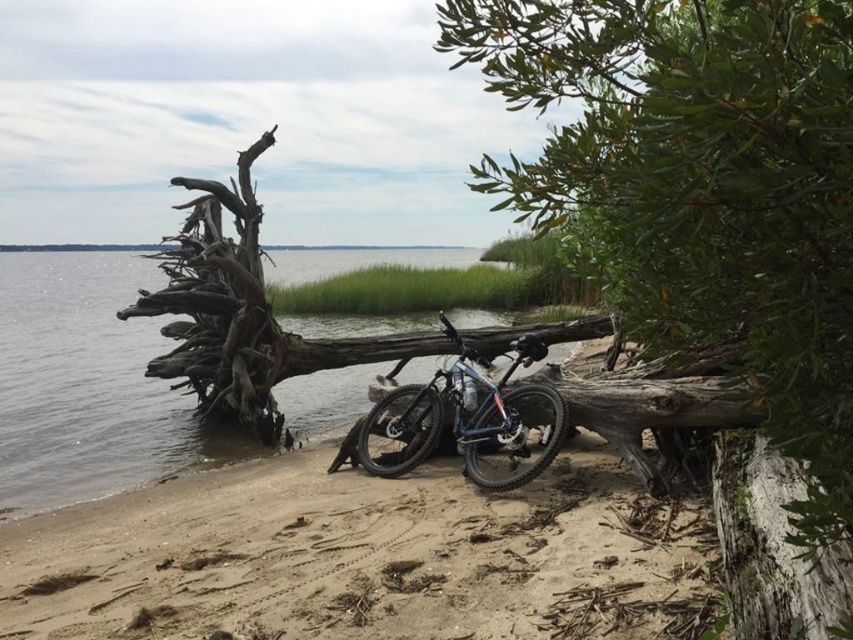
Question: Which point is closer to the camera taking this photo?

Choices:
 (A) (560, 400)
 (B) (4, 253)
 (C) (270, 497)

Answer: (A)

Question: Can you confirm if clear water at center is smaller than shiny metallic bicycle at center?

Choices:
 (A) yes
 (B) no

Answer: (B)

Question: Which point is farther to the camera?

Choices:
 (A) (523, 205)
 (B) (96, 481)
 (C) (398, 512)

Answer: (B)

Question: From the image, what is the correct spatial relationship of green leafy tree at center in relation to shiny metallic bicycle at center?

Choices:
 (A) left
 (B) right

Answer: (B)

Question: Which object is the farthest from the green leafy tree at center?

Choices:
 (A) clear water at center
 (B) sandy beach at lower left

Answer: (A)

Question: Can you confirm if sandy beach at lower left is positioned to the right of clear water at center?

Choices:
 (A) yes
 (B) no

Answer: (A)